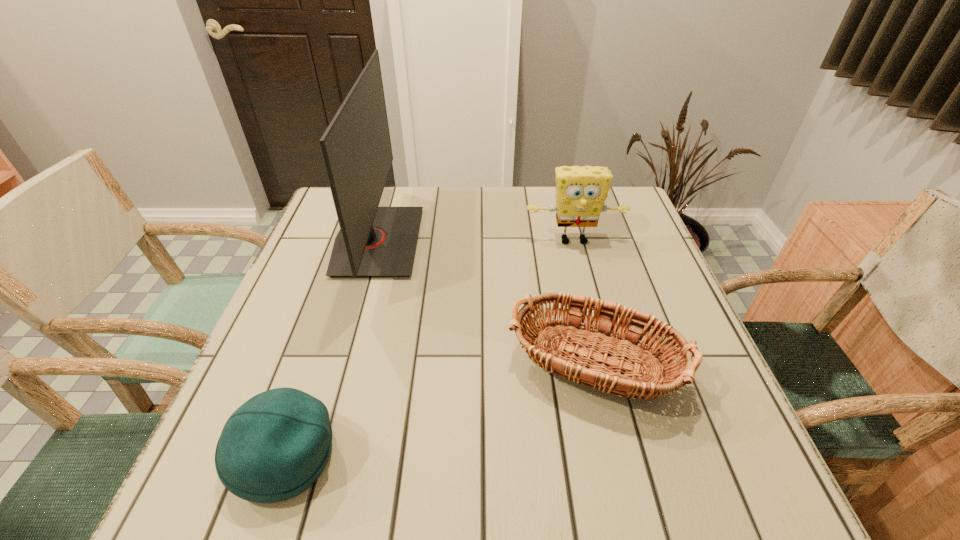
At what (x,y) coordinates should I click in order to perform the action: click on the tallest object. Please return your answer as a coordinate pair (x, y). This screenshot has width=960, height=540. Looking at the image, I should click on (373, 241).

At what (x,y) coordinates should I click in order to perform the action: click on sponge. Please return your answer as a coordinate pair (x, y). Looking at the image, I should click on (581, 192).

At what (x,y) coordinates should I click in order to perform the action: click on basket. Please return your answer as a coordinate pair (x, y). Image resolution: width=960 pixels, height=540 pixels. Looking at the image, I should click on (566, 333).

Find the location of `beanie`. beanie is located at coordinates (274, 446).

At what (x,y) coordinates should I click in order to perform the action: click on blank area located 0.220m on the screen side of the tallest object. Please return your answer as a coordinate pair (x, y). The width and height of the screenshot is (960, 540). Looking at the image, I should click on (500, 241).

This screenshot has width=960, height=540. Find the location of `free location located on the face of the sponge`. free location located on the face of the sponge is located at coordinates 584,280.

You are a GUI agent. You are given a task and a screenshot of the screen. Output one action in this format:
    pyautogui.click(x=<x>, y=<y>)
    Task: Click on the vacant space located 0.330m on the left of the basket
    This screenshot has height=540, width=960.
    Given the screenshot: What is the action you would take?
    pyautogui.click(x=319, y=377)

Identify the location of free spot located on the right of the beanie. The image size is (960, 540). (478, 456).

Locate an element on the screen. Image resolution: width=960 pixels, height=540 pixels. monitor located in the far edge section of the desktop is located at coordinates (373, 241).

The height and width of the screenshot is (540, 960). Identify the location of sponge present at the far edge. (581, 192).